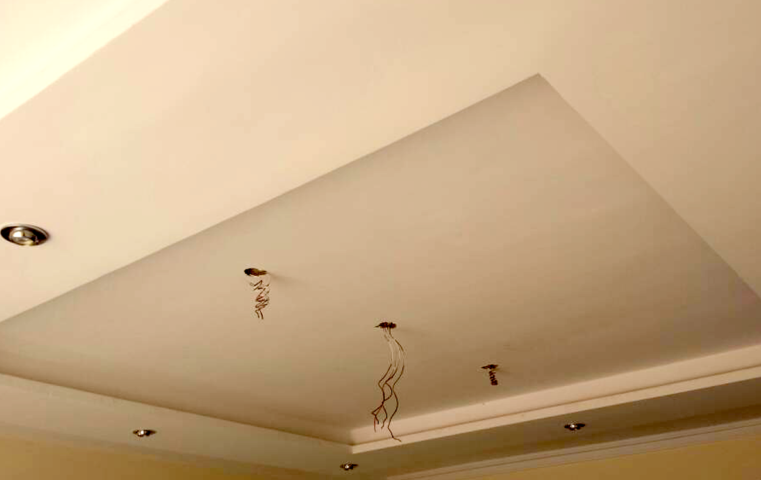
The width and height of the screenshot is (761, 480). Find the location of `inner ceiling corners`. inner ceiling corners is located at coordinates (539, 74), (354, 443).